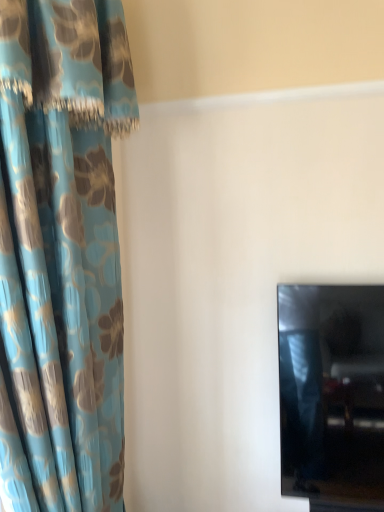
What do you see at coordinates (62, 253) in the screenshot?
I see `blue floral fabric curtain at left` at bounding box center [62, 253].

Identify the location of blue floral fabric curtain at left. (62, 253).

Find the location of a particular element. This screenshot has width=384, height=512. blue floral fabric curtain at left is located at coordinates (62, 253).